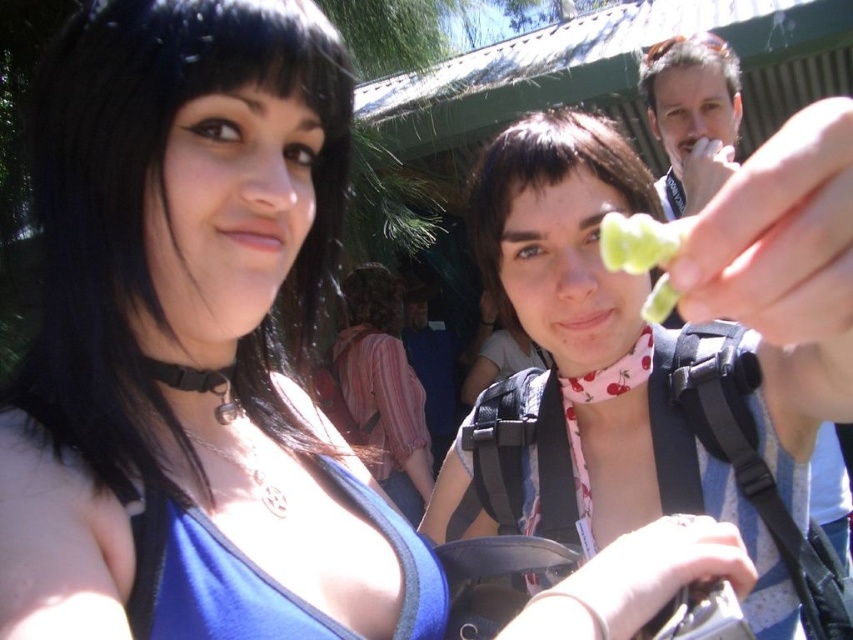
Does point (437, 515) come farther from viewer compared to point (712, 163)?

No, (437, 515) is in front of (712, 163).

This screenshot has width=853, height=640. What do you see at coordinates (660, 348) in the screenshot?
I see `translucent plastic gummy bear at center` at bounding box center [660, 348].

Identify the location of translucent plastic gummy bear at center. This screenshot has width=853, height=640. (660, 348).

Locate an element on the screen. This screenshot has height=640, width=853. translucent plastic gummy bear at center is located at coordinates (660, 348).

Is smooth skin face at upper right taller than green leafy vegetable at center?

Indeed, smooth skin face at upper right has a greater height compared to green leafy vegetable at center.

Is point (672, 38) closer to camera compared to point (631, 266)?

No.

Image resolution: width=853 pixels, height=640 pixels. I want to click on smooth skin face at upper right, so (x=693, y=113).

Can you confirm if translucent plastic gummy bear at center is wider than green leafy vegetable at center?

Indeed, translucent plastic gummy bear at center has a greater width compared to green leafy vegetable at center.

Between translucent plastic gummy bear at center and green leafy vegetable at center, which one is positioned higher?

green leafy vegetable at center

Does point (749, 474) lie in front of point (610, 237)?

No, it is behind (610, 237).

Image resolution: width=853 pixels, height=640 pixels. In order to click on translucent plastic gummy bear at center in this screenshot , I will do `click(660, 348)`.